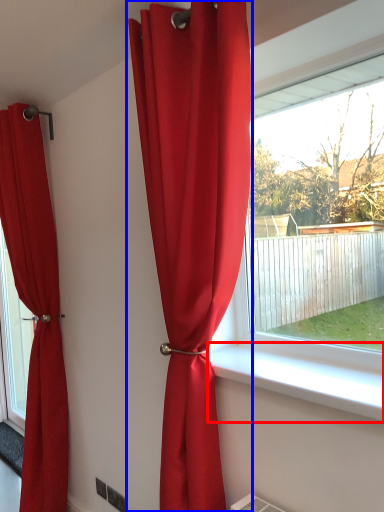
Question: Which of the following is the closest to the observer, window sill (highlighted by a red box) or curtain (highlighted by a blue box)?

Choices:
 (A) window sill
 (B) curtain

Answer: (A)